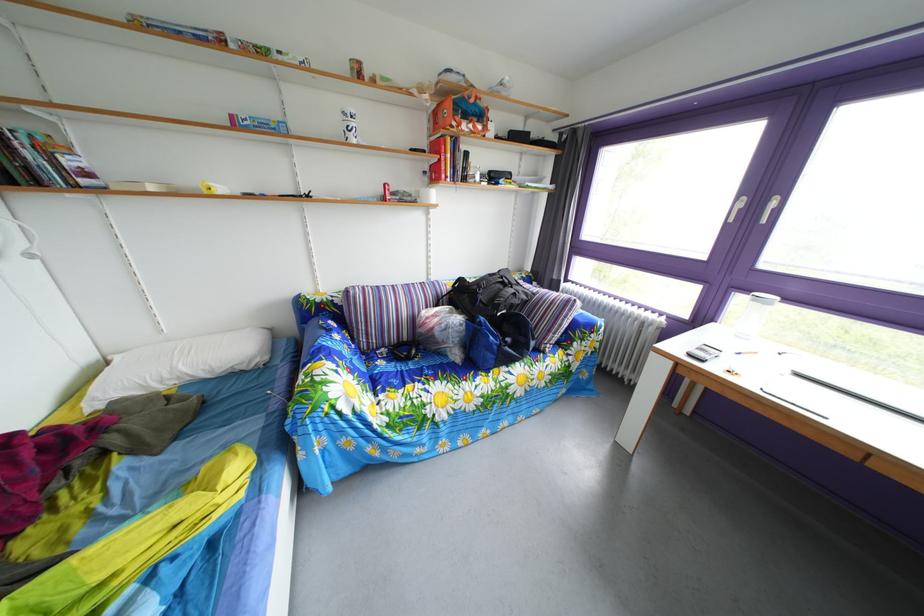
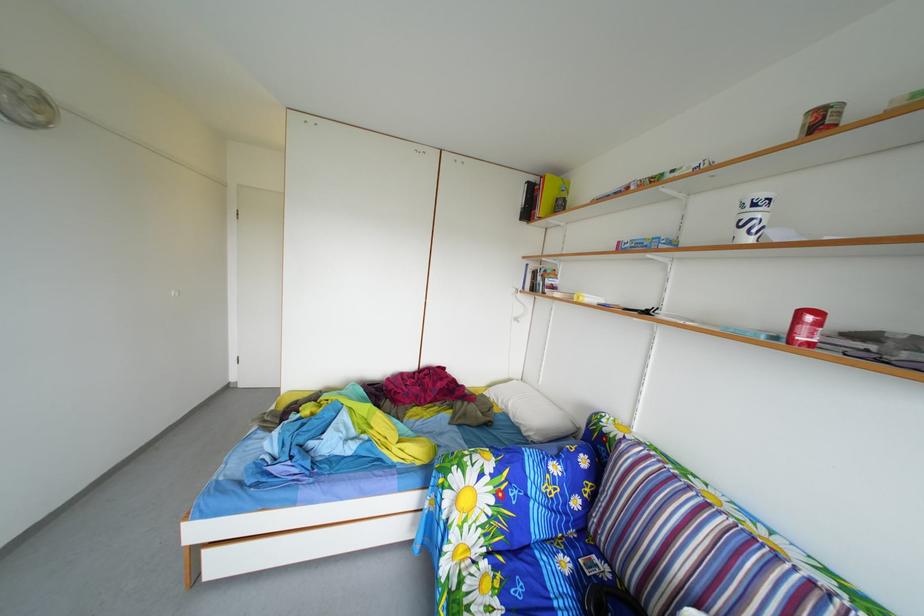
Locate, in the second image, the point that corresponds to (x=395, y=193) in the first image.

(811, 321)